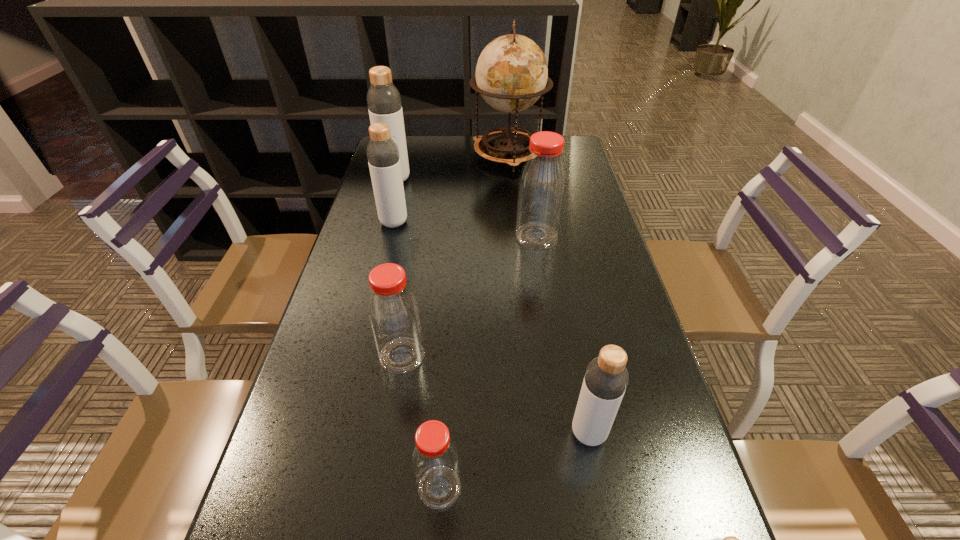
Identify which object is located as the fifth nearest to the nearest gray bottle. Please provide its 2D coordinates. Your answer should be formatted as a tuple, i.e. [(x, y)], where the tuple contains the x and y coordinates of a point satisfying the conditions above.

[(383, 157)]

You are a GUI agent. You are given a task and a screenshot of the screen. Output one action in this format:
    pyautogui.click(x=<x>, y=<y>)
    Task: Click on the bottle that stands as the fourth closest to the globe
    The image size is (960, 540).
    Given the screenshot: What is the action you would take?
    pyautogui.click(x=393, y=311)

Select which bottle is the second closest to the biggest gray bottle. Please provide its 2D coordinates. Your answer should be formatted as a tuple, i.e. [(x, y)], where the tuple contains the x and y coordinates of a point satisfying the conditions above.

[(542, 184)]

At what (x,y) coordinates should I click in order to perform the action: click on the closest gray bottle to the third biggest gray bottle. Please return your answer as a coordinate pair (x, y). Looking at the image, I should click on (729, 539).

Image resolution: width=960 pixels, height=540 pixels. Identify the location of gray bottle that is the second closest to the nearest gray bottle. (383, 157).

Locate which red bottle is the closest to the leftmost red bottle. Please provide its 2D coordinates. Your answer should be formatted as a tuple, i.e. [(x, y)], where the tuple contains the x and y coordinates of a point satisfying the conditions above.

[(435, 459)]

The width and height of the screenshot is (960, 540). Identify the location of the third closest red bottle relative to the second biggest gray bottle. (435, 459).

I want to click on free space that satisfies the following two spatial constraints: 1. at the center of the tallest object; 2. on the right side of the farthest red bottle, so click(x=516, y=237).

Where is `free space that satisfies the following two spatial constraints: 1. on the front side of the rightmost red bottle; 2. on the right side of the second farthest gray bottle`? The image size is (960, 540). free space that satisfies the following two spatial constraints: 1. on the front side of the rightmost red bottle; 2. on the right side of the second farthest gray bottle is located at coordinates (391, 237).